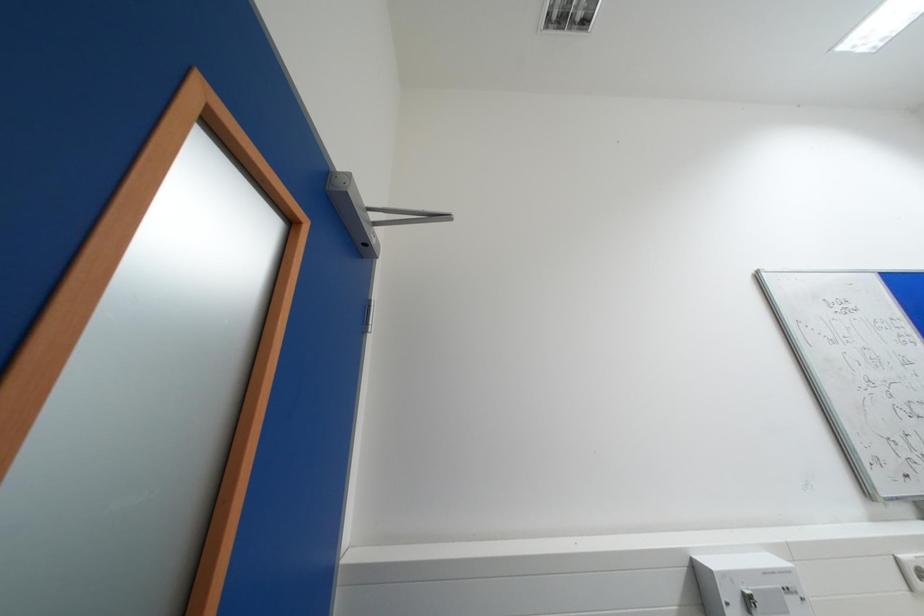
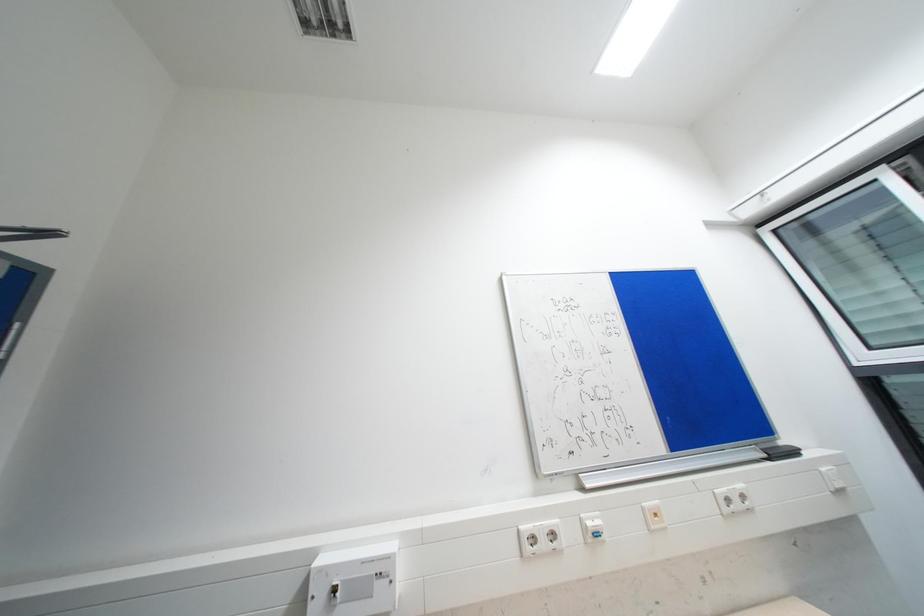
Question: Which direction would the cameraman need to move to produce the second image? Reply with the corresponding letter.

Choices:
 (A) Left
 (B) Right
 (C) Forward
 (D) Backward

Answer: (B)